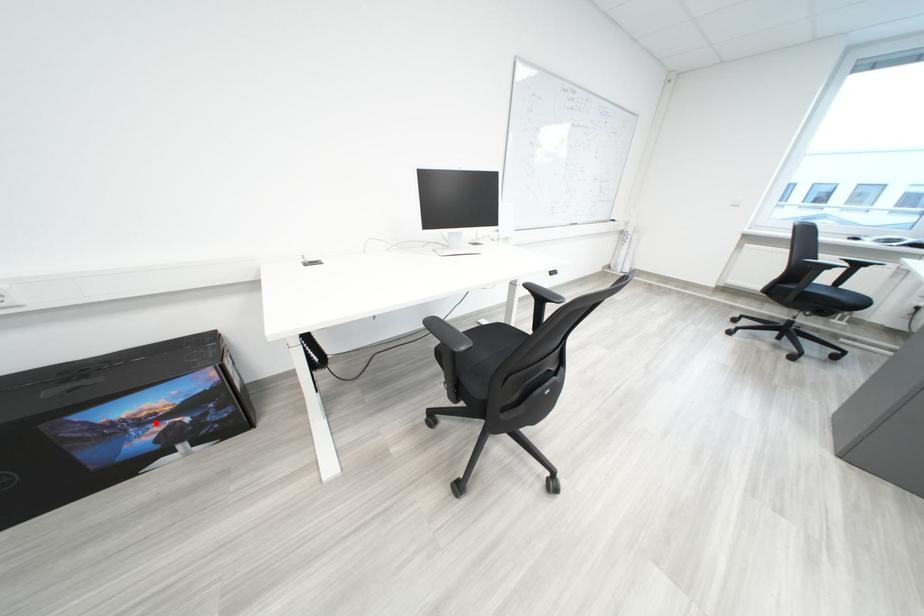
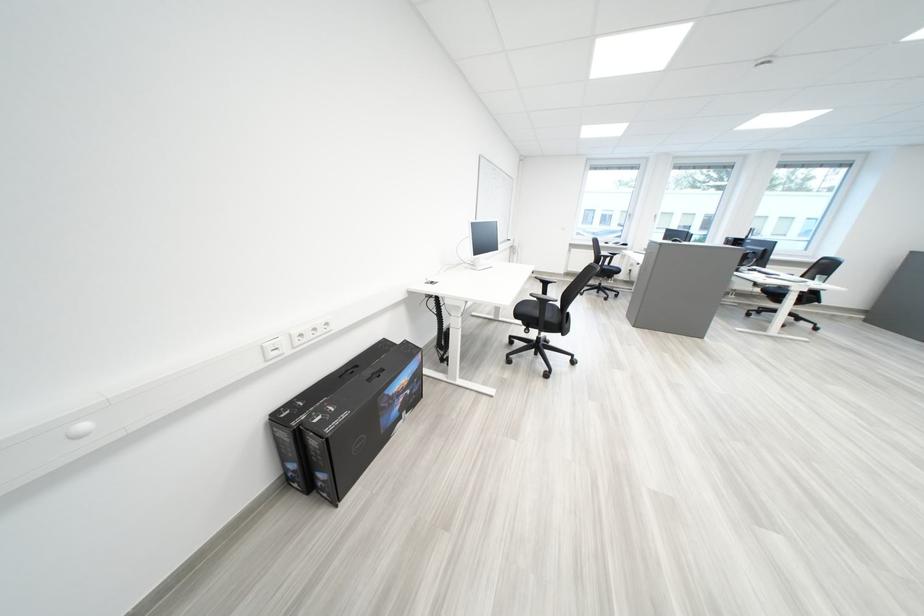
Question: I am providing you with two images of the same scene from different viewpoints. In image1, a red point is highlighted. Considering the same 3D point in image2, which of the following is correct?

Choices:
 (A) It is closer
 (B) It is farther

Answer: (A)